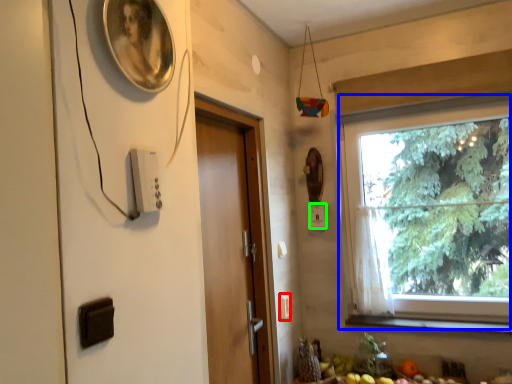
Question: Based on their relative distances, which object is nearer to light switch (highlighted by a red box)? Choose from window (highlighted by a blue box) and light switch (highlighted by a green box).

Choices:
 (A) window
 (B) light switch

Answer: (B)